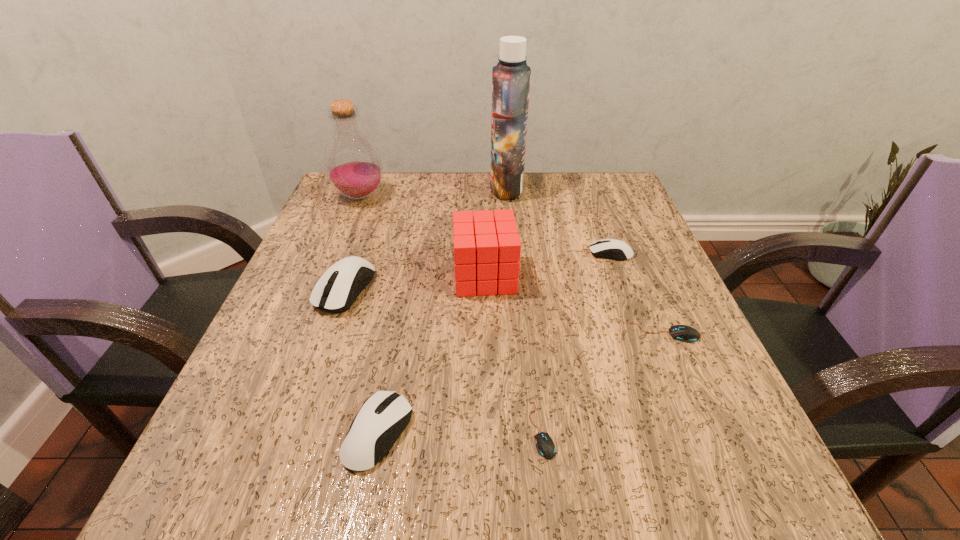
Where is `object positioned at the far left corner`? This screenshot has width=960, height=540. object positioned at the far left corner is located at coordinates (352, 162).

What are the coordinates of `vacant space at the far edge of the desktop` in the screenshot? It's located at (526, 198).

Where is `free location at the left edge`? This screenshot has width=960, height=540. free location at the left edge is located at coordinates (290, 363).

The width and height of the screenshot is (960, 540). I want to click on free point at the right edge, so click(646, 271).

Locate an element on the screen. vacant space at the far left corner of the desktop is located at coordinates (355, 212).

What are the coordinates of `vacant space at the far right corner of the desktop` in the screenshot? It's located at (581, 209).

The height and width of the screenshot is (540, 960). Find the location of `free space at the near right corner`. free space at the near right corner is located at coordinates (780, 498).

Where is `vacant space that's between the bottle and the nearest white mouse`? vacant space that's between the bottle and the nearest white mouse is located at coordinates (369, 315).

Find the location of a particular element. The width and height of the screenshot is (960, 540). vacant space in between the fourth tallest mouse and the tallest object is located at coordinates click(586, 260).

At what (x,y) coordinates should I click in order to perform the action: click on free area in between the third tallest mouse and the fourth shortest mouse. Please return your answer as a coordinate pair (x, y). Image resolution: width=960 pixels, height=540 pixels. Looking at the image, I should click on (494, 343).